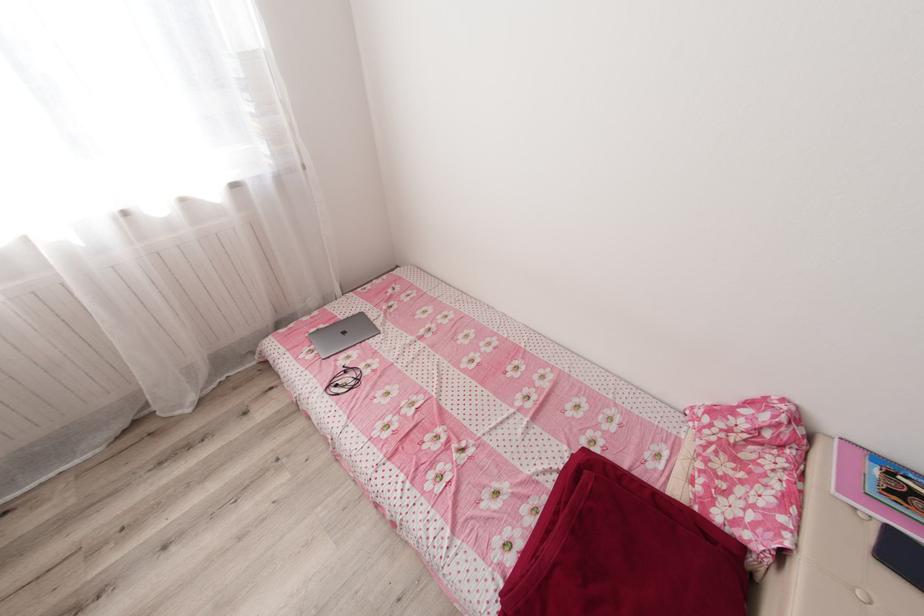
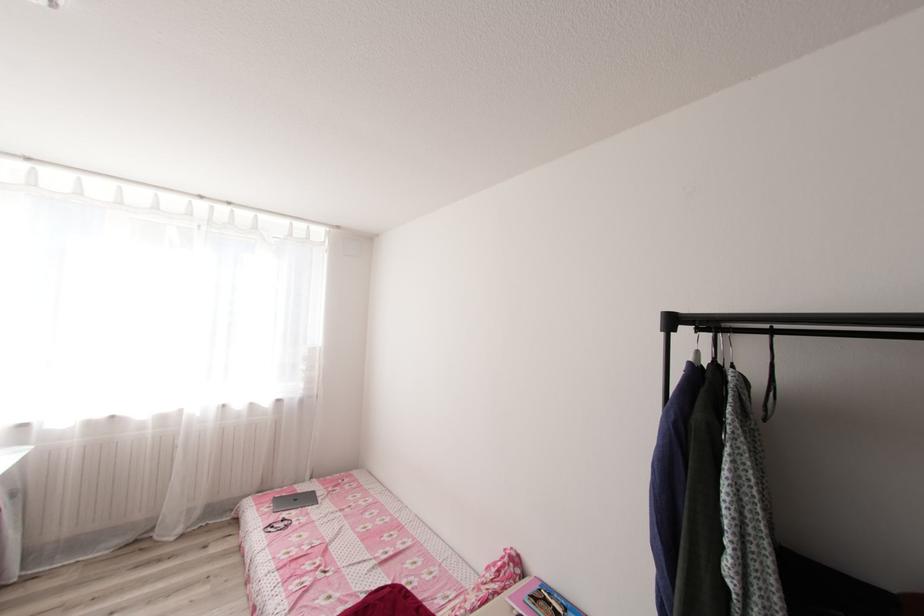
In the second image, find the point that corresponds to pixel 353 379 in the first image.

(286, 525)